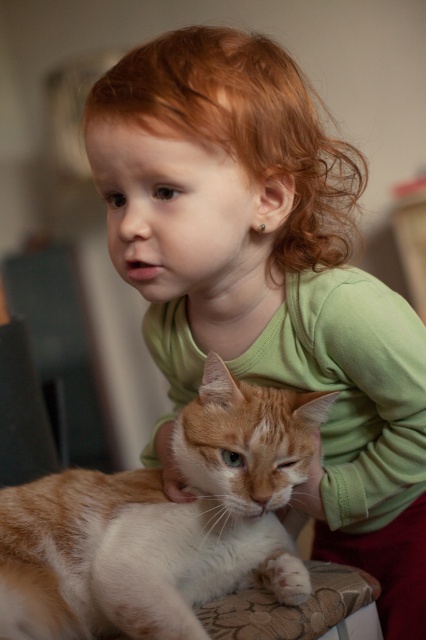
You are a photographer trying to capture the cat in the scene. The cat is represented by the point at coordinates point (158, 522). Where should you aim your camera to ensure you capture the orange and white fur cat at lower left?

The orange and white fur cat at lower left is represented by point (158, 522), so aim your camera at that coordinate to capture it.